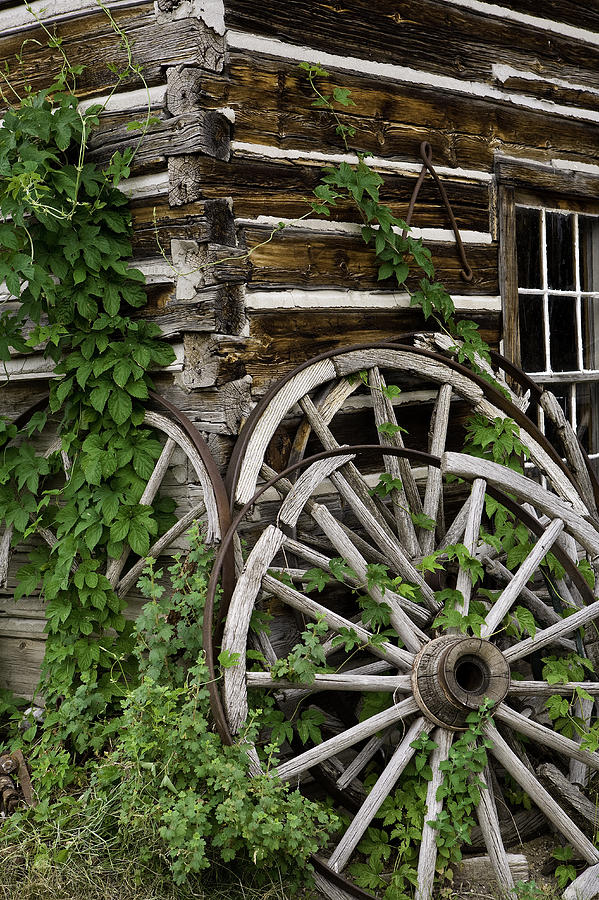
Identify the location of window pane. This screenshot has width=599, height=900. (561, 322).